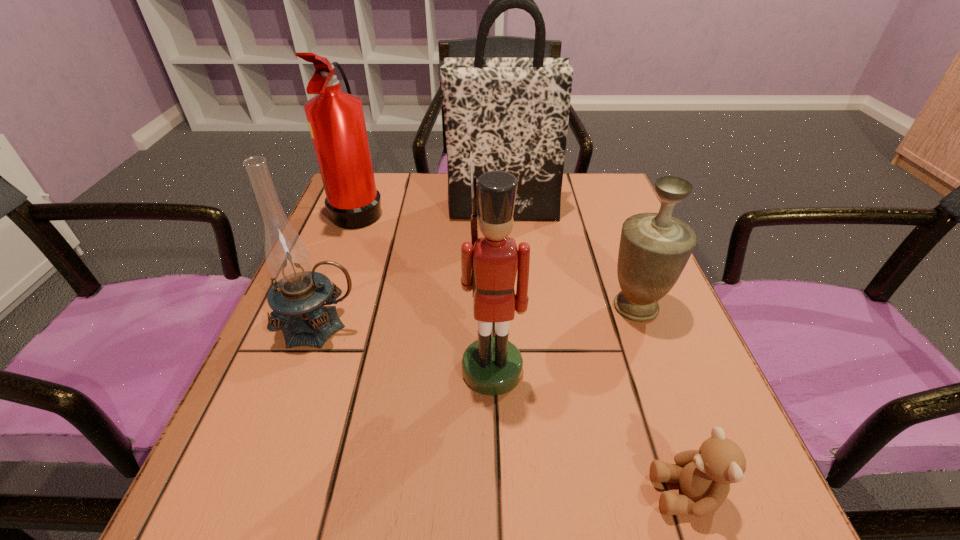
Locate an element on the screen. The height and width of the screenshot is (540, 960). free spot between the fire extinguisher and the teddy bear is located at coordinates (522, 352).

The image size is (960, 540). In order to click on vacant area that lies between the nearest object and the fire extinguisher in this screenshot , I will do `click(522, 352)`.

Where is `vacant space that is in between the teddy bear and the shopping bag`? The height and width of the screenshot is (540, 960). vacant space that is in between the teddy bear and the shopping bag is located at coordinates (594, 352).

Identify the location of vacant area that lies between the nearest object and the nutcracker. The height and width of the screenshot is (540, 960). (589, 432).

Identify the location of unoccupied area between the shopping bag and the urn. (569, 258).

Locate an element on the screen. This screenshot has width=960, height=540. vacant region between the nutcracker and the fire extinguisher is located at coordinates (425, 290).

Where is `vacant region between the shopping bag and the oil lamp`? vacant region between the shopping bag and the oil lamp is located at coordinates (412, 268).

Image resolution: width=960 pixels, height=540 pixels. What are the coordinates of `empty space between the teddy bear and the urn` in the screenshot? It's located at (661, 400).

Find the location of a particular element. vacant point located between the oil lamp and the shopping bag is located at coordinates click(412, 268).

Find the location of a particular element. the second closest object relative to the urn is located at coordinates (512, 113).